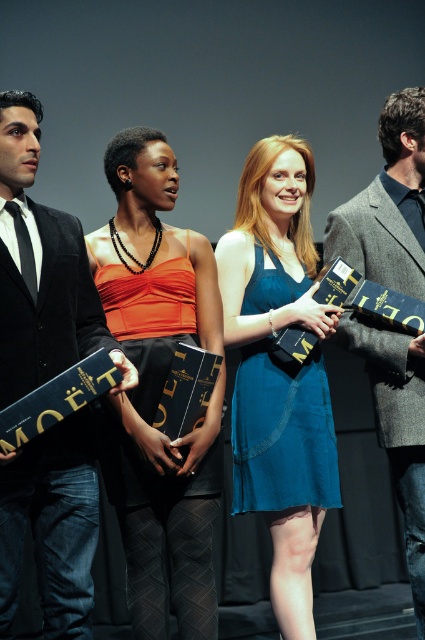
You are a photographer at an event and need to adjust the camera focus. The black suit at left and the teal denim dress at center are two subjects. How far apart are they in inches?

The black suit at left is 25.61 inches from the teal denim dress at center.

You are at a fashion show and need to decide which dress to approach first. There is an orange satin dress at center and a teal denim dress at center. Which one is closer to you?

The orange satin dress at center is closer to the viewer than the teal denim dress at center, so you should approach the orange satin dress at center first.